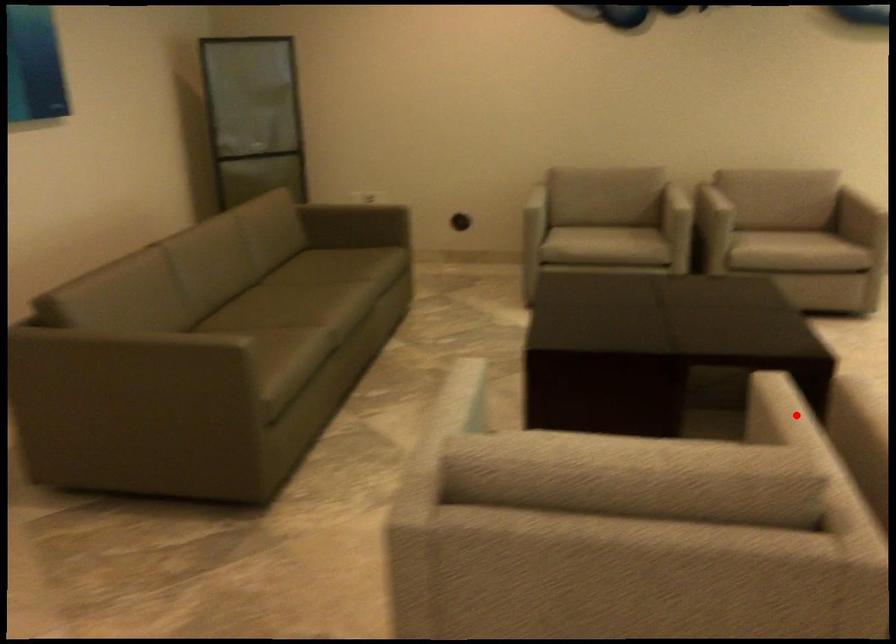
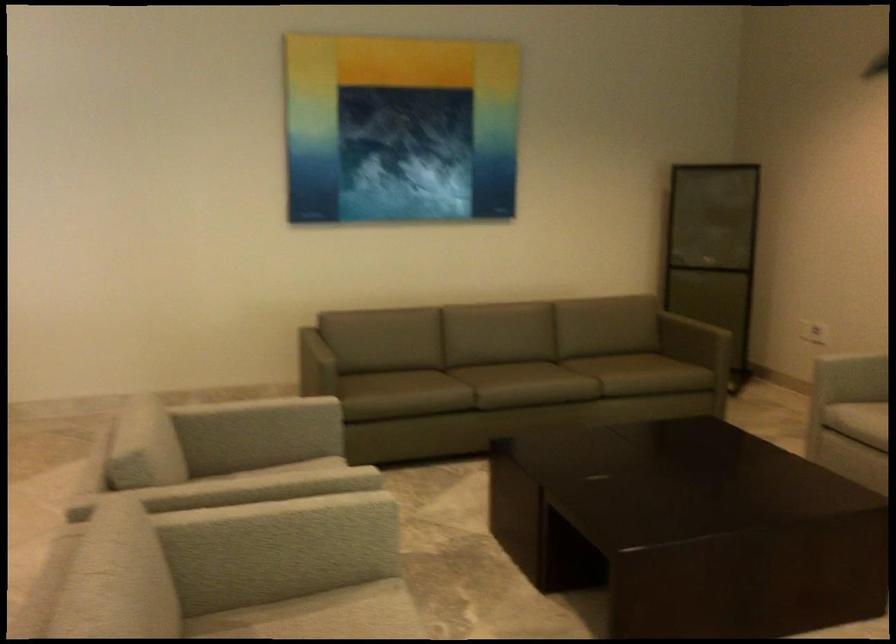
Where in the second image is the point corresponding to the highlighted location from the first image?

(254, 484)